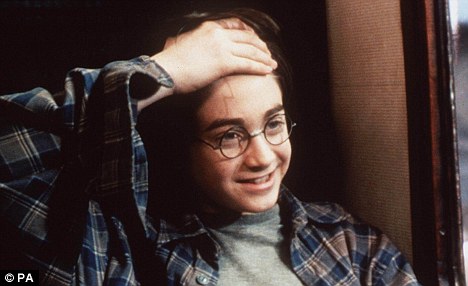
Where is `backwalls`? This screenshot has width=468, height=286. backwalls is located at coordinates (69, 27), (303, 15), (375, 51).